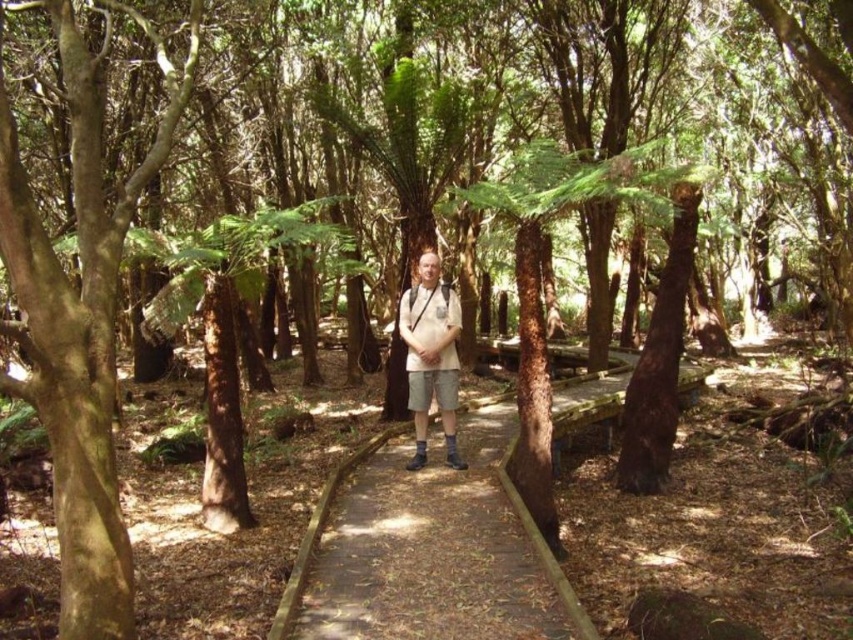
Does brown rough bark tree at left appear on the left side of wooden boardwalk at center?

Indeed, brown rough bark tree at left is positioned on the left side of wooden boardwalk at center.

Who is lower down, brown rough bark tree at left or wooden boardwalk at center?

Positioned lower is wooden boardwalk at center.

Image resolution: width=853 pixels, height=640 pixels. What do you see at coordinates (80, 316) in the screenshot?
I see `brown rough bark tree at left` at bounding box center [80, 316].

This screenshot has height=640, width=853. I want to click on brown rough bark tree at left, so click(80, 316).

Between brown rough bark tree at left and white cotton shirt at center, which one has more height?

brown rough bark tree at left

Can you confirm if brown rough bark tree at left is positioned above white cotton shirt at center?

Correct, brown rough bark tree at left is located above white cotton shirt at center.

Image resolution: width=853 pixels, height=640 pixels. What are the coordinates of `brown rough bark tree at left` in the screenshot? It's located at (80, 316).

Where is `brown rough bark tree at left`? brown rough bark tree at left is located at coordinates (80, 316).

Does wooden boardwalk at center have a lesser width compared to white cotton shirt at center?

Incorrect, wooden boardwalk at center's width is not less than white cotton shirt at center's.

Does wooden boardwalk at center appear over white cotton shirt at center?

Incorrect, wooden boardwalk at center is not positioned above white cotton shirt at center.

Between point (483, 541) and point (451, 376), which one is positioned in front?

Positioned in front is point (483, 541).

Identify the location of wooden boardwalk at center. Image resolution: width=853 pixels, height=640 pixels. (424, 552).